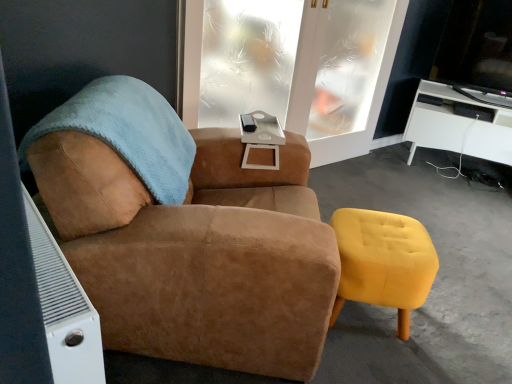
Question: Considering the relative sizes of white glossy desk at right and suede brown armchair at center in the image provided, is white glossy desk at right wider than suede brown armchair at center?

Choices:
 (A) no
 (B) yes

Answer: (A)

Question: Is white glossy desk at right facing towards suede brown armchair at center?

Choices:
 (A) yes
 (B) no

Answer: (A)

Question: Are white glossy desk at right and suede brown armchair at center located far from each other?

Choices:
 (A) no
 (B) yes

Answer: (B)

Question: Is white glossy desk at right looking in the opposite direction of suede brown armchair at center?

Choices:
 (A) yes
 (B) no

Answer: (B)

Question: From the image's perspective, is white glossy desk at right on top of suede brown armchair at center?

Choices:
 (A) yes
 (B) no

Answer: (A)

Question: In the image, is yellow velvet stool at lower right positioned in front of or behind white matte side table at center?

Choices:
 (A) behind
 (B) front

Answer: (B)

Question: From the image's perspective, is yellow velvet stool at lower right positioned above or below white matte side table at center?

Choices:
 (A) above
 (B) below

Answer: (B)

Question: In terms of width, does yellow velvet stool at lower right look wider or thinner when compared to white matte side table at center?

Choices:
 (A) thin
 (B) wide

Answer: (B)

Question: Considering the positions of yellow velvet stool at lower right and white matte side table at center in the image, is yellow velvet stool at lower right taller or shorter than white matte side table at center?

Choices:
 (A) short
 (B) tall

Answer: (B)

Question: From the image's perspective, is frosted glass window at center above or below white glossy desk at right?

Choices:
 (A) below
 (B) above

Answer: (B)

Question: From a real-world perspective, is frosted glass window at center positioned above or below white glossy desk at right?

Choices:
 (A) below
 (B) above

Answer: (B)

Question: Do you think frosted glass window at center is within white glossy desk at right, or outside of it?

Choices:
 (A) outside
 (B) inside

Answer: (A)

Question: Considering the positions of frosted glass window at center and white glossy desk at right in the image, is frosted glass window at center taller or shorter than white glossy desk at right?

Choices:
 (A) short
 (B) tall

Answer: (B)

Question: From the image's perspective, relative to frosted glass window at center, is white glossy desk at right above or below?

Choices:
 (A) above
 (B) below

Answer: (B)

Question: From a real-world perspective, is white glossy desk at right positioned above or below frosted glass window at center?

Choices:
 (A) above
 (B) below

Answer: (B)